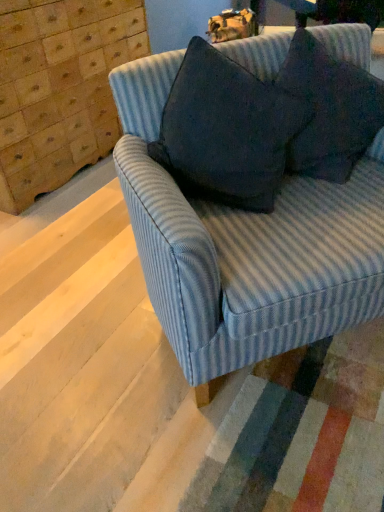
What do you see at coordinates (60, 89) in the screenshot? I see `wooden dresser at upper left` at bounding box center [60, 89].

This screenshot has height=512, width=384. I want to click on wooden dresser at upper left, so click(x=60, y=89).

What is the approximate width of blue striped fabric couch at center?

blue striped fabric couch at center is 34.60 inches in width.

Image resolution: width=384 pixels, height=512 pixels. What do you see at coordinates (330, 109) in the screenshot?
I see `dark fabric pillow at upper right, which is counted as the 1th throw pillow, starting from the right` at bounding box center [330, 109].

How much space does dark gray fabric pillow at upper right, arranged as the second throw pillow when viewed from the right, occupy horizontally?

dark gray fabric pillow at upper right, arranged as the second throw pillow when viewed from the right, is 14.89 inches wide.

The width and height of the screenshot is (384, 512). What are the coordinates of `wooden dresser at upper left` in the screenshot? It's located at (60, 89).

Is point (316, 86) positioned after point (307, 221)?

Yes.

Considering the relative sizes of dark fabric pillow at upper right, which is counted as the second throw pillow, starting from the left, and blue striped fabric couch at center in the image provided, is dark fabric pillow at upper right, which is counted as the second throw pillow, starting from the left, shorter than blue striped fabric couch at center?

Indeed, dark fabric pillow at upper right, which is counted as the second throw pillow, starting from the left, has a lesser height compared to blue striped fabric couch at center.

From the image's perspective, is dark fabric pillow at upper right, which is counted as the 1th throw pillow, starting from the right, below blue striped fabric couch at center?

Incorrect, from the image's perspective, dark fabric pillow at upper right, which is counted as the 1th throw pillow, starting from the right, is higher than blue striped fabric couch at center.

Considering the sizes of objects dark fabric pillow at upper right, which is counted as the second throw pillow, starting from the left, and blue striped fabric couch at center in the image provided, who is bigger, dark fabric pillow at upper right, which is counted as the second throw pillow, starting from the left, or blue striped fabric couch at center?

blue striped fabric couch at center is bigger.

Is dark gray fabric pillow at upper right, arranged as the second throw pillow when viewed from the right, wider or thinner than wooden dresser at upper left?

Clearly, dark gray fabric pillow at upper right, arranged as the second throw pillow when viewed from the right, has less width compared to wooden dresser at upper left.

Between dark gray fabric pillow at upper right, the first throw pillow when ordered from left to right, and wooden dresser at upper left, which one has smaller size?

Smaller between the two is dark gray fabric pillow at upper right, the first throw pillow when ordered from left to right.

Consider the image. From the image's perspective, which one is positioned higher, dark gray fabric pillow at upper right, arranged as the second throw pillow when viewed from the right, or wooden dresser at upper left?

From the image's view, wooden dresser at upper left is above.

Is blue striped fabric couch at center shorter than dark gray fabric pillow at upper right, arranged as the second throw pillow when viewed from the right?

Incorrect, the height of blue striped fabric couch at center does not fall short of that of dark gray fabric pillow at upper right, arranged as the second throw pillow when viewed from the right.

Is blue striped fabric couch at center located outside dark gray fabric pillow at upper right, arranged as the second throw pillow when viewed from the right?

blue striped fabric couch at center lies outside dark gray fabric pillow at upper right, arranged as the second throw pillow when viewed from the right,'s area.

Is blue striped fabric couch at center positioned behind dark gray fabric pillow at upper right, the first throw pillow when ordered from left to right?

No, blue striped fabric couch at center is closer to the camera.

Between blue striped fabric couch at center and dark gray fabric pillow at upper right, the first throw pillow when ordered from left to right, which one has smaller width?

dark gray fabric pillow at upper right, the first throw pillow when ordered from left to right.

Where is `dresser behind the blue striped fabric couch at center`? dresser behind the blue striped fabric couch at center is located at coordinates (60, 89).

Is wooden dresser at upper left facing towards blue striped fabric couch at center?

Yes, wooden dresser at upper left faces towards blue striped fabric couch at center.

Which object is further away from the camera taking this photo, wooden dresser at upper left or blue striped fabric couch at center?

wooden dresser at upper left is more distant.

Considering the sizes of dark gray fabric pillow at upper right, arranged as the second throw pillow when viewed from the right, and blue striped fabric couch at center in the image, is dark gray fabric pillow at upper right, arranged as the second throw pillow when viewed from the right, bigger or smaller than blue striped fabric couch at center?

Clearly, dark gray fabric pillow at upper right, arranged as the second throw pillow when viewed from the right, is smaller in size than blue striped fabric couch at center.

Considering the relative sizes of dark gray fabric pillow at upper right, the first throw pillow when ordered from left to right, and blue striped fabric couch at center in the image provided, is dark gray fabric pillow at upper right, the first throw pillow when ordered from left to right, taller than blue striped fabric couch at center?

In fact, dark gray fabric pillow at upper right, the first throw pillow when ordered from left to right, may be shorter than blue striped fabric couch at center.

Is the position of dark gray fabric pillow at upper right, arranged as the second throw pillow when viewed from the right, more distant than that of blue striped fabric couch at center?

Yes, it is behind blue striped fabric couch at center.

Is blue striped fabric couch at center further to camera compared to dark fabric pillow at upper right, which is counted as the 1th throw pillow, starting from the right?

No, it is in front of dark fabric pillow at upper right, which is counted as the 1th throw pillow, starting from the right.

In the scene shown: Can you confirm if blue striped fabric couch at center is smaller than dark fabric pillow at upper right, which is counted as the 1th throw pillow, starting from the right?

Actually, blue striped fabric couch at center might be larger than dark fabric pillow at upper right, which is counted as the 1th throw pillow, starting from the right.

In the scene shown: Could you measure the distance between wooden dresser at upper left and dark fabric pillow at upper right, which is counted as the 1th throw pillow, starting from the right?

wooden dresser at upper left is 1.51 meters away from dark fabric pillow at upper right, which is counted as the 1th throw pillow, starting from the right.

From the image's perspective, between wooden dresser at upper left and dark fabric pillow at upper right, which is counted as the 1th throw pillow, starting from the right, which one is located above?

wooden dresser at upper left is shown above in the image.

Considering the sizes of wooden dresser at upper left and dark fabric pillow at upper right, which is counted as the 1th throw pillow, starting from the right, in the image, is wooden dresser at upper left wider or thinner than dark fabric pillow at upper right, which is counted as the 1th throw pillow, starting from the right,?

In the image, wooden dresser at upper left appears to be wider than dark fabric pillow at upper right, which is counted as the 1th throw pillow, starting from the right.

Can you confirm if wooden dresser at upper left is shorter than dark fabric pillow at upper right, which is counted as the second throw pillow, starting from the left?

No, wooden dresser at upper left is not shorter than dark fabric pillow at upper right, which is counted as the second throw pillow, starting from the left.

Locate an element on the screen. The height and width of the screenshot is (512, 384). studio couch below the dark fabric pillow at upper right, which is counted as the second throw pillow, starting from the left (from the image's perspective) is located at coordinates (245, 247).

Identify the location of dresser on the left side of dark gray fabric pillow at upper right, the first throw pillow when ordered from left to right. (60, 89).

In the scene shown: Considering their positions, is blue striped fabric couch at center positioned closer to wooden dresser at upper left than dark fabric pillow at upper right, which is counted as the 1th throw pillow, starting from the right?

The object closer to wooden dresser at upper left is blue striped fabric couch at center.

Considering their positions, is dark fabric pillow at upper right, which is counted as the second throw pillow, starting from the left, positioned further to dark gray fabric pillow at upper right, arranged as the second throw pillow when viewed from the right, than wooden dresser at upper left?

Based on the image, wooden dresser at upper left appears to be further to dark gray fabric pillow at upper right, arranged as the second throw pillow when viewed from the right.

Which object lies further to the anchor point dark fabric pillow at upper right, which is counted as the 1th throw pillow, starting from the right, dark gray fabric pillow at upper right, arranged as the second throw pillow when viewed from the right, or blue striped fabric couch at center?

Among the two, blue striped fabric couch at center is located further to dark fabric pillow at upper right, which is counted as the 1th throw pillow, starting from the right.

Estimate the real-world distances between objects in this image. Which object is closer to dark gray fabric pillow at upper right, arranged as the second throw pillow when viewed from the right, wooden dresser at upper left or dark fabric pillow at upper right, which is counted as the second throw pillow, starting from the left?

dark fabric pillow at upper right, which is counted as the second throw pillow, starting from the left, is positioned closer to the anchor dark gray fabric pillow at upper right, arranged as the second throw pillow when viewed from the right.

From the image, which object appears to be nearer to wooden dresser at upper left, dark gray fabric pillow at upper right, arranged as the second throw pillow when viewed from the right, or blue striped fabric couch at center?

Based on the image, dark gray fabric pillow at upper right, arranged as the second throw pillow when viewed from the right, appears to be nearer to wooden dresser at upper left.

Looking at the image, which one is located closer to blue striped fabric couch at center, wooden dresser at upper left or dark gray fabric pillow at upper right, arranged as the second throw pillow when viewed from the right?

The object closer to blue striped fabric couch at center is dark gray fabric pillow at upper right, arranged as the second throw pillow when viewed from the right.

Which object lies nearer to the anchor point dark gray fabric pillow at upper right, the first throw pillow when ordered from left to right, wooden dresser at upper left or blue striped fabric couch at center?

Based on the image, blue striped fabric couch at center appears to be nearer to dark gray fabric pillow at upper right, the first throw pillow when ordered from left to right.

From the image, which object appears to be nearer to dark fabric pillow at upper right, which is counted as the second throw pillow, starting from the left, wooden dresser at upper left or dark gray fabric pillow at upper right, the first throw pillow when ordered from left to right?

The object closer to dark fabric pillow at upper right, which is counted as the second throw pillow, starting from the left, is dark gray fabric pillow at upper right, the first throw pillow when ordered from left to right.

I want to click on studio couch between wooden dresser at upper left and dark fabric pillow at upper right, which is counted as the 1th throw pillow, starting from the right, in the horizontal direction, so click(245, 247).

At what (x,y) coordinates should I click in order to perform the action: click on throw pillow between wooden dresser at upper left and dark fabric pillow at upper right, which is counted as the 1th throw pillow, starting from the right. Please return your answer as a coordinate pair (x, y). Looking at the image, I should click on (227, 131).

Find the location of a particular element. This screenshot has height=512, width=384. throw pillow between blue striped fabric couch at center and dark fabric pillow at upper right, which is counted as the second throw pillow, starting from the left, along the z-axis is located at coordinates (227, 131).

Where is `throw pillow between wooden dresser at upper left and blue striped fabric couch at center`? The image size is (384, 512). throw pillow between wooden dresser at upper left and blue striped fabric couch at center is located at coordinates (227, 131).